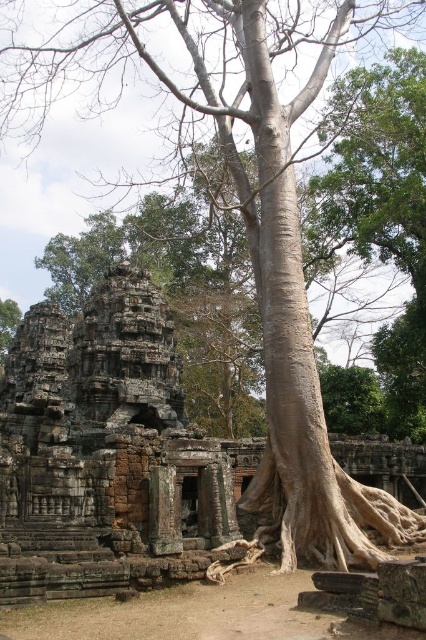
Is point (3, 445) farther from camera compared to point (247, 547)?

Yes, it is.

Based on the photo, can you confirm if brown stone ruins at center is bigger than brown rough tree root at center?

Yes, brown stone ruins at center is bigger than brown rough tree root at center.

The image size is (426, 640). I want to click on brown stone ruins at center, so click(108, 452).